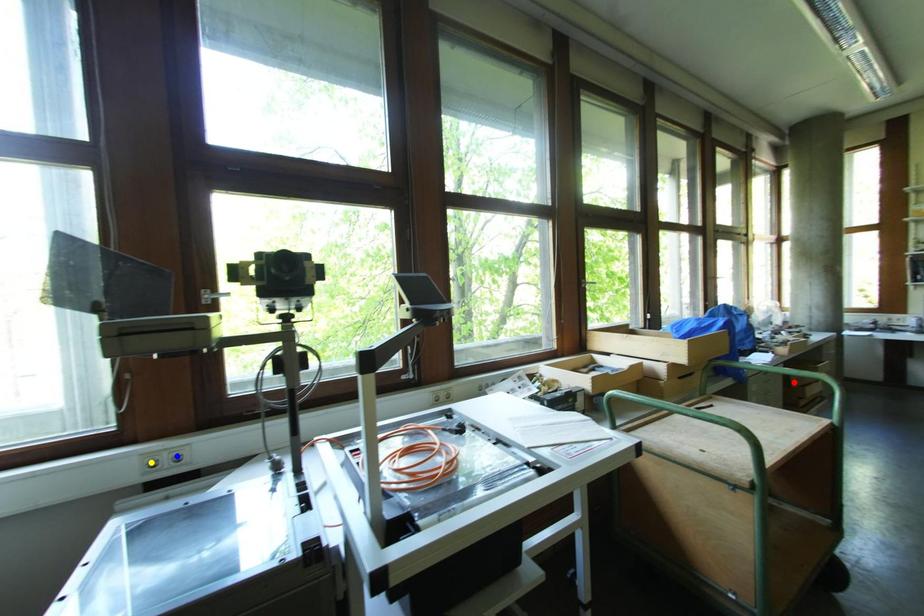
Order these from nearest to farthest:
blue point
yellow point
red point

yellow point < blue point < red point